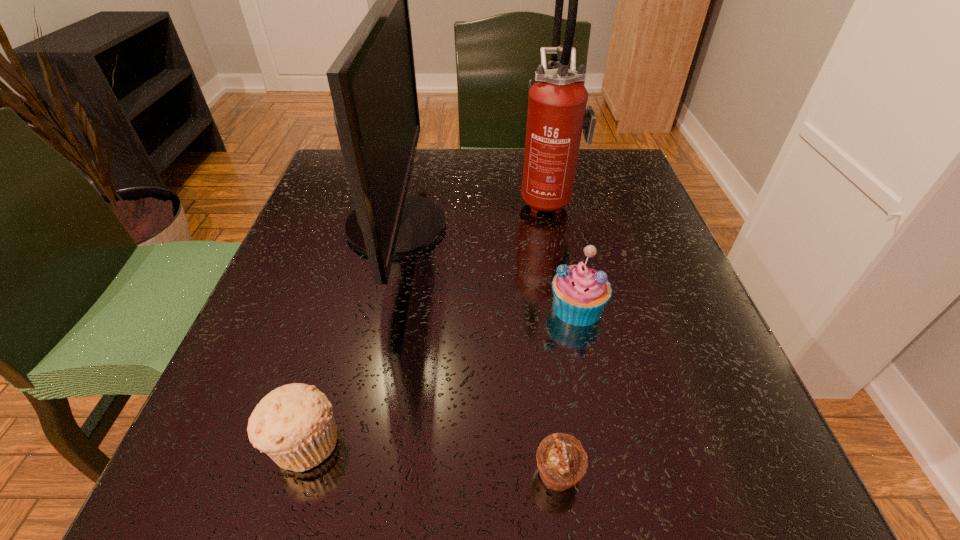
The width and height of the screenshot is (960, 540). Identify the location of fire extinguisher present at the far edge. (557, 113).

Identify the location of monitor that is at the far edge. The image size is (960, 540). [x=372, y=81].

Find the location of `monitor that is at the left edge`. monitor that is at the left edge is located at coordinates (372, 81).

At what (x,y) coordinates should I click in order to perform the action: click on muffin positioned at the left edge. Please return your answer as a coordinate pair (x, y). Looking at the image, I should click on (294, 425).

The width and height of the screenshot is (960, 540). I want to click on fire extinguisher at the right edge, so click(557, 113).

Identify the location of muffin present at the right edge. (580, 293).

Where is `object at the far left corner`? Image resolution: width=960 pixels, height=540 pixels. object at the far left corner is located at coordinates (372, 81).

The height and width of the screenshot is (540, 960). What are the coordinates of `object that is at the near left corner` in the screenshot? It's located at [x=294, y=425].

Where is `object situated at the far right corner`? object situated at the far right corner is located at coordinates (557, 113).

In order to click on vacant position at the far edge of the desktop in this screenshot , I will do `click(420, 158)`.